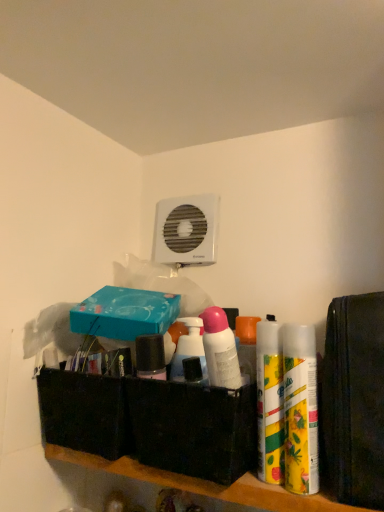
Image resolution: width=384 pixels, height=512 pixels. What do you see at coordinates (300, 409) in the screenshot?
I see `yellow matte spray can at right, which ranks as the first cleaning product in right-to-left order` at bounding box center [300, 409].

Where is `yellow matte spray can at right, which ranks as the first cleaning product in right-to-left order`? The image size is (384, 512). yellow matte spray can at right, which ranks as the first cleaning product in right-to-left order is located at coordinates (300, 409).

Measure the distance between pink plastic spray bottle at center, which ranks as the third cleaning product in right-to-left order, and camera.

pink plastic spray bottle at center, which ranks as the third cleaning product in right-to-left order, and camera are 22.35 inches apart from each other.

The height and width of the screenshot is (512, 384). Describe the element at coordinates (125, 313) in the screenshot. I see `teal matte box at upper center, arranged as the second box when ordered from the bottom` at that location.

At what (x,y) coordinates should I click in order to perform the action: click on yellow matte can at right, acting as the 2th cleaning product starting from the right. Please return your answer as a coordinate pair (x, y). Image resolution: width=384 pixels, height=512 pixels. Looking at the image, I should click on tap(270, 401).

Would you say pink plastic spray bottle at center, marked as the first cleaning product in a left-to-right arrangement, is outside yellow matte spray can at right, which ranks as the first cleaning product in right-to-left order?

Yes, pink plastic spray bottle at center, marked as the first cleaning product in a left-to-right arrangement, is outside of yellow matte spray can at right, which ranks as the first cleaning product in right-to-left order.

Would you say pink plastic spray bottle at center, marked as the first cleaning product in a left-to-right arrangement, is a long distance from yellow matte spray can at right, which ranks as the 3th cleaning product in left-to-right order?

No, pink plastic spray bottle at center, marked as the first cleaning product in a left-to-right arrangement, is in close proximity to yellow matte spray can at right, which ranks as the 3th cleaning product in left-to-right order.

From the image's perspective, would you say pink plastic spray bottle at center, which ranks as the third cleaning product in right-to-left order, is positioned over yellow matte spray can at right, which ranks as the first cleaning product in right-to-left order?

Yes, from the image's perspective, pink plastic spray bottle at center, which ranks as the third cleaning product in right-to-left order, is above yellow matte spray can at right, which ranks as the first cleaning product in right-to-left order.

Looking at their sizes, would you say pink plastic spray bottle at center, marked as the first cleaning product in a left-to-right arrangement, is wider or thinner than yellow matte spray can at right, which ranks as the 3th cleaning product in left-to-right order?

Clearly, pink plastic spray bottle at center, marked as the first cleaning product in a left-to-right arrangement, has less width compared to yellow matte spray can at right, which ranks as the 3th cleaning product in left-to-right order.

Considering the sizes of teal matte box at upper center, arranged as the second box when ordered from the bottom, and yellow matte spray can at right, which ranks as the 3th cleaning product in left-to-right order, in the image, is teal matte box at upper center, arranged as the second box when ordered from the bottom, taller or shorter than yellow matte spray can at right, which ranks as the 3th cleaning product in left-to-right order,?

teal matte box at upper center, arranged as the second box when ordered from the bottom, is shorter than yellow matte spray can at right, which ranks as the 3th cleaning product in left-to-right order.

Is teal matte box at upper center, the 1th box when ordered from top to bottom, positioned beyond the bounds of yellow matte spray can at right, which ranks as the first cleaning product in right-to-left order?

Yes, teal matte box at upper center, the 1th box when ordered from top to bottom, is located beyond the bounds of yellow matte spray can at right, which ranks as the first cleaning product in right-to-left order.

Is teal matte box at upper center, arranged as the second box when ordered from the bottom, to the right of yellow matte spray can at right, which ranks as the first cleaning product in right-to-left order, from the viewer's perspective?

In fact, teal matte box at upper center, arranged as the second box when ordered from the bottom, is to the left of yellow matte spray can at right, which ranks as the first cleaning product in right-to-left order.

Is pink plastic spray bottle at center, which ranks as the third cleaning product in right-to-left order, completely or partially outside of yellow matte can at right, which is the 2th cleaning product in left-to-right order?

Indeed, pink plastic spray bottle at center, which ranks as the third cleaning product in right-to-left order, is completely outside yellow matte can at right, which is the 2th cleaning product in left-to-right order.

I want to click on the 1st cleaning product to the right of the pink plastic spray bottle at center, which ranks as the third cleaning product in right-to-left order, starting your count from the anchor, so (x=270, y=401).

Between pink plastic spray bottle at center, which ranks as the third cleaning product in right-to-left order, and yellow matte can at right, which is the 2th cleaning product in left-to-right order, which one has more height?

With more height is yellow matte can at right, which is the 2th cleaning product in left-to-right order.

Is point (219, 385) closer to camera compared to point (261, 386)?

Yes, point (219, 385) is in front of point (261, 386).

How many degrees apart are the facing directions of black fabric basket at center, marked as the second box in a top-to-bottom arrangement, and pink plastic spray bottle at center, which ranks as the third cleaning product in right-to-left order?

The facing directions of black fabric basket at center, marked as the second box in a top-to-bottom arrangement, and pink plastic spray bottle at center, which ranks as the third cleaning product in right-to-left order, are 0.00241 degrees apart.

Find the location of a particular element. the 1st box behind the pink plastic spray bottle at center, which ranks as the third cleaning product in right-to-left order is located at coordinates (191, 428).

Is black fabric basket at center, marked as the second box in a top-to-bottom arrangement, positioned in front of pink plastic spray bottle at center, which ranks as the third cleaning product in right-to-left order?

No, it is not.

Is black fabric basket at center, marked as the second box in a top-to-bottom arrangement, aimed at pink plastic spray bottle at center, which ranks as the third cleaning product in right-to-left order?

Yes, black fabric basket at center, marked as the second box in a top-to-bottom arrangement, is oriented towards pink plastic spray bottle at center, which ranks as the third cleaning product in right-to-left order.

In the scene shown: Considering the sizes of objects pink plastic spray bottle at center, marked as the first cleaning product in a left-to-right arrangement, and black fabric basket at center, which is the 1th box in bottom-to-top order, in the image provided, who is wider, pink plastic spray bottle at center, marked as the first cleaning product in a left-to-right arrangement, or black fabric basket at center, which is the 1th box in bottom-to-top order,?

Wider between the two is black fabric basket at center, which is the 1th box in bottom-to-top order.

Is pink plastic spray bottle at center, which ranks as the third cleaning product in right-to-left order, situated inside black fabric basket at center, marked as the second box in a top-to-bottom arrangement, or outside?

pink plastic spray bottle at center, which ranks as the third cleaning product in right-to-left order, exists outside the volume of black fabric basket at center, marked as the second box in a top-to-bottom arrangement.

Consider the image. Is pink plastic spray bottle at center, which ranks as the third cleaning product in right-to-left order, positioned far away from black fabric basket at center, marked as the second box in a top-to-bottom arrangement?

No.

In the scene shown: Is pink plastic spray bottle at center, marked as the first cleaning product in a left-to-right arrangement, to the right of black fabric basket at center, marked as the second box in a top-to-bottom arrangement, from the viewer's perspective?

Yes, pink plastic spray bottle at center, marked as the first cleaning product in a left-to-right arrangement, is to the right of black fabric basket at center, marked as the second box in a top-to-bottom arrangement.

From the image's perspective, which is above, pink plastic spray bottle at center, which ranks as the third cleaning product in right-to-left order, or teal matte box at upper center, arranged as the second box when ordered from the bottom?

teal matte box at upper center, arranged as the second box when ordered from the bottom, appears higher in the image.

Between pink plastic spray bottle at center, which ranks as the third cleaning product in right-to-left order, and teal matte box at upper center, the 1th box when ordered from top to bottom, which one has more height?

pink plastic spray bottle at center, which ranks as the third cleaning product in right-to-left order, is taller.

From the pink plastic spray bottle at center, which ranks as the third cleaning product in right-to-left order, count the 2nd box to the left and point to it. Please provide its 2D coordinates.

[(125, 313)]

Based on the photo, which of these two, pink plastic spray bottle at center, marked as the first cleaning product in a left-to-right arrangement, or teal matte box at upper center, arranged as the second box when ordered from the bottom, is wider?

Wider between the two is teal matte box at upper center, arranged as the second box when ordered from the bottom.

Considering the positions of points (261, 330) and (291, 373), is point (261, 330) closer to camera compared to point (291, 373)?

No, it is not.

Which is behind, yellow matte can at right, which is the 2th cleaning product in left-to-right order, or yellow matte spray can at right, which ranks as the first cleaning product in right-to-left order?

yellow matte can at right, which is the 2th cleaning product in left-to-right order, is further from the camera.

Between yellow matte can at right, acting as the 2th cleaning product starting from the right, and yellow matte spray can at right, which ranks as the first cleaning product in right-to-left order, which one has larger width?

yellow matte spray can at right, which ranks as the first cleaning product in right-to-left order.

Visually, is yellow matte can at right, which is the 2th cleaning product in left-to-right order, positioned to the left or to the right of yellow matte spray can at right, which ranks as the 3th cleaning product in left-to-right order?

Clearly, yellow matte can at right, which is the 2th cleaning product in left-to-right order, is on the left of yellow matte spray can at right, which ranks as the 3th cleaning product in left-to-right order, in the image.

The width and height of the screenshot is (384, 512). I want to click on cleaning product that is above the yellow matte spray can at right, which ranks as the 3th cleaning product in left-to-right order (from the image's perspective), so click(220, 349).

You are a GUI agent. You are given a task and a screenshot of the screen. Output one action in this format:
    pyautogui.click(x=<x>, y=<y>)
    Task: Click on the cleaning product that is the 2nd one when counting downward from the teal matte box at upper center, arranged as the second box when ordered from the bottom (from the image's perspective)
    The height and width of the screenshot is (512, 384).
    Given the screenshot: What is the action you would take?
    pyautogui.click(x=300, y=409)

Based on their spatial positions, is pink plastic spray bottle at center, marked as the first cleaning product in a left-to-right arrangement, or yellow matte spray can at right, which ranks as the first cleaning product in right-to-left order, further from yellow matte can at right, acting as the 2th cleaning product starting from the right?

pink plastic spray bottle at center, marked as the first cleaning product in a left-to-right arrangement.

Based on their spatial positions, is teal matte box at upper center, the 1th box when ordered from top to bottom, or yellow matte can at right, which is the 2th cleaning product in left-to-right order, closer to yellow matte spray can at right, which ranks as the first cleaning product in right-to-left order?

yellow matte can at right, which is the 2th cleaning product in left-to-right order, is closer to yellow matte spray can at right, which ranks as the first cleaning product in right-to-left order.

Based on their spatial positions, is teal matte box at upper center, arranged as the second box when ordered from the bottom, or black fabric basket at center, marked as the second box in a top-to-bottom arrangement, closer to pink plastic spray bottle at center, which ranks as the third cleaning product in right-to-left order?

The object closer to pink plastic spray bottle at center, which ranks as the third cleaning product in right-to-left order, is black fabric basket at center, marked as the second box in a top-to-bottom arrangement.

From the picture: Considering their positions, is pink plastic spray bottle at center, marked as the first cleaning product in a left-to-right arrangement, positioned closer to teal matte box at upper center, arranged as the second box when ordered from the bottom, than yellow matte spray can at right, which ranks as the 3th cleaning product in left-to-right order?

pink plastic spray bottle at center, marked as the first cleaning product in a left-to-right arrangement, is closer to teal matte box at upper center, arranged as the second box when ordered from the bottom.

From the image, which object appears to be nearer to teal matte box at upper center, the 1th box when ordered from top to bottom, yellow matte spray can at right, which ranks as the first cleaning product in right-to-left order, or yellow matte can at right, which is the 2th cleaning product in left-to-right order?

yellow matte can at right, which is the 2th cleaning product in left-to-right order, lies closer to teal matte box at upper center, the 1th box when ordered from top to bottom, than the other object.

When comparing their distances from black fabric basket at center, which is the 1th box in bottom-to-top order, does pink plastic spray bottle at center, marked as the first cleaning product in a left-to-right arrangement, or yellow matte spray can at right, which ranks as the 3th cleaning product in left-to-right order, seem further?

yellow matte spray can at right, which ranks as the 3th cleaning product in left-to-right order, lies further to black fabric basket at center, which is the 1th box in bottom-to-top order, than the other object.

Estimate the real-world distances between objects in this image. Which object is closer to teal matte box at upper center, the 1th box when ordered from top to bottom, yellow matte can at right, which is the 2th cleaning product in left-to-right order, or yellow matte spray can at right, which ranks as the first cleaning product in right-to-left order?

The object closer to teal matte box at upper center, the 1th box when ordered from top to bottom, is yellow matte can at right, which is the 2th cleaning product in left-to-right order.

Looking at the image, which one is located closer to teal matte box at upper center, arranged as the second box when ordered from the bottom, yellow matte spray can at right, which ranks as the first cleaning product in right-to-left order, or pink plastic spray bottle at center, which ranks as the third cleaning product in right-to-left order?

The object closer to teal matte box at upper center, arranged as the second box when ordered from the bottom, is pink plastic spray bottle at center, which ranks as the third cleaning product in right-to-left order.

Identify the location of cleaning product between teal matte box at upper center, arranged as the second box when ordered from the bottom, and yellow matte can at right, acting as the 2th cleaning product starting from the right, from left to right. This screenshot has height=512, width=384. (220, 349).

Find the location of `cleaning product between black fabric basket at center, marked as the second box in a top-to-bottom arrangement, and yellow matte can at right, which is the 2th cleaning product in left-to-right order, in the horizontal direction`. cleaning product between black fabric basket at center, marked as the second box in a top-to-bottom arrangement, and yellow matte can at right, which is the 2th cleaning product in left-to-right order, in the horizontal direction is located at coordinates (220, 349).

Identify the location of box between teal matte box at upper center, arranged as the second box when ordered from the bottom, and pink plastic spray bottle at center, marked as the first cleaning product in a left-to-right arrangement. The image size is (384, 512). (x=191, y=428).

The image size is (384, 512). What are the coordinates of `box situated between teal matte box at upper center, the 1th box when ordered from top to bottom, and yellow matte spray can at right, which ranks as the first cleaning product in right-to-left order, from left to right` in the screenshot? It's located at (191, 428).